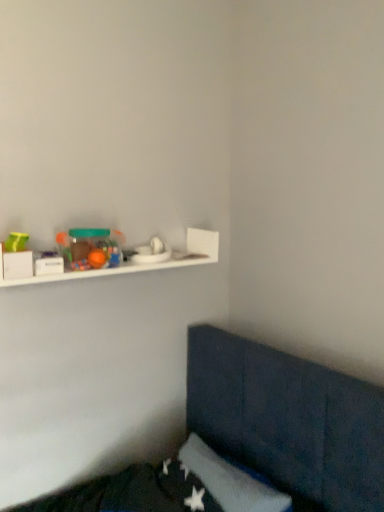
Question: From a real-world perspective, is white matte shelf at upper left positioned above or below matte plastic container at upper left?

Choices:
 (A) above
 (B) below

Answer: (B)

Question: Which is correct: white matte shelf at upper left is inside matte plastic container at upper left, or outside of it?

Choices:
 (A) inside
 (B) outside

Answer: (B)

Question: Is white matte shelf at upper left bigger or smaller than matte plastic container at upper left?

Choices:
 (A) small
 (B) big

Answer: (B)

Question: Does point (99, 258) appear closer or farther from the camera than point (188, 248)?

Choices:
 (A) closer
 (B) farther

Answer: (A)

Question: From the image's perspective, is matte plastic container at upper left above or below white matte shelf at upper left?

Choices:
 (A) below
 (B) above

Answer: (B)

Question: Considering the relative positions of matte plastic container at upper left and white matte shelf at upper left in the image provided, is matte plastic container at upper left to the left or to the right of white matte shelf at upper left?

Choices:
 (A) left
 (B) right

Answer: (A)

Question: Considering their positions, is matte plastic container at upper left located in front of or behind white matte shelf at upper left?

Choices:
 (A) behind
 (B) front

Answer: (A)